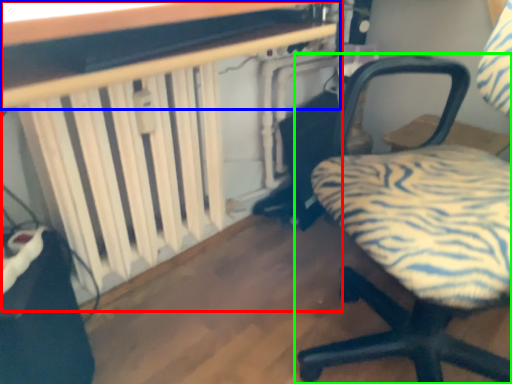
Question: Estimate the real-world distances between objects in this image. Which object is closer to table (highlighted by a red box), table (highlighted by a blue box) or chair (highlighted by a green box)?

Choices:
 (A) table
 (B) chair

Answer: (A)